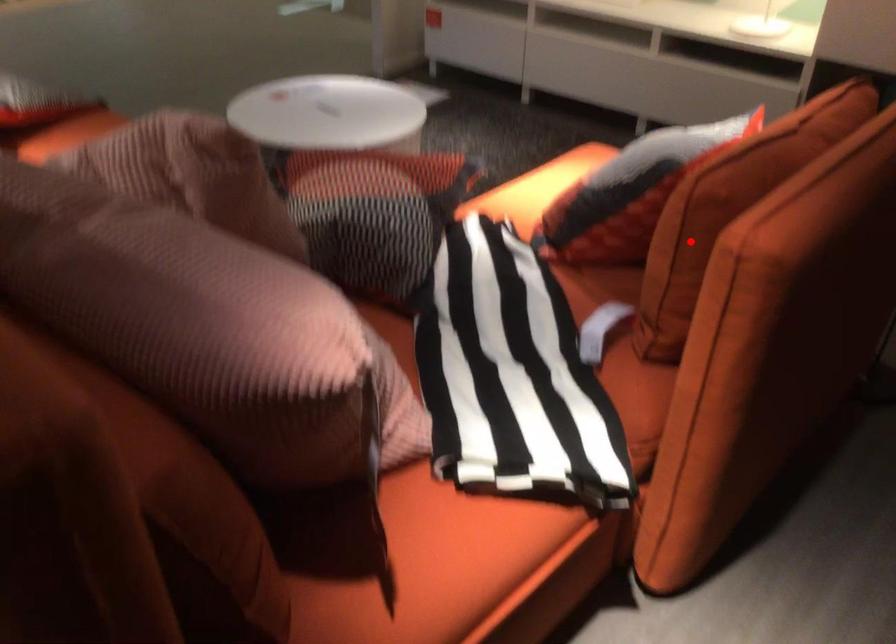
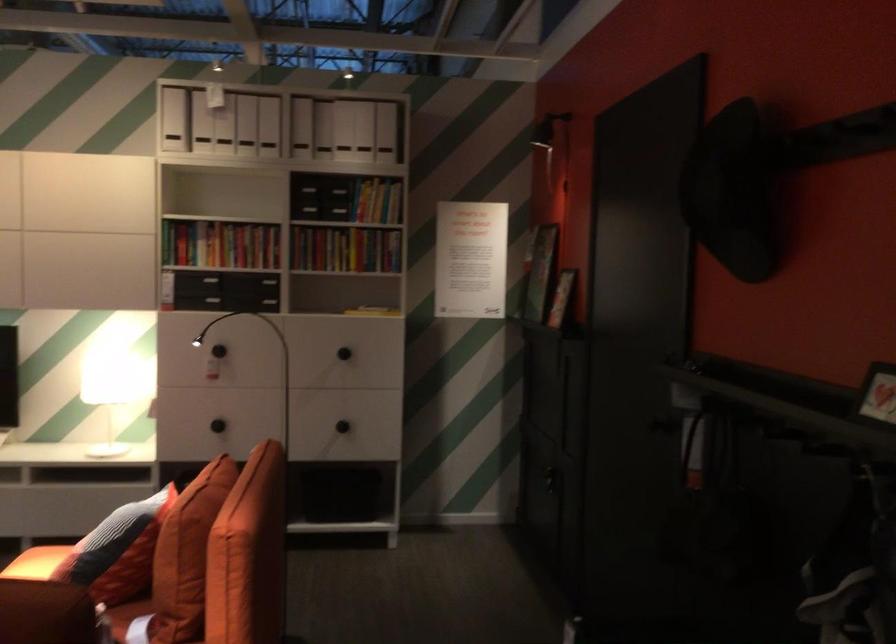
Question: I am providing you with two images of the same scene from different viewpoints. A red point is shown in image1. For the corresponding object point in image2, is it positioned nearer or farther from the camera?

Choices:
 (A) Nearer
 (B) Farther

Answer: (B)